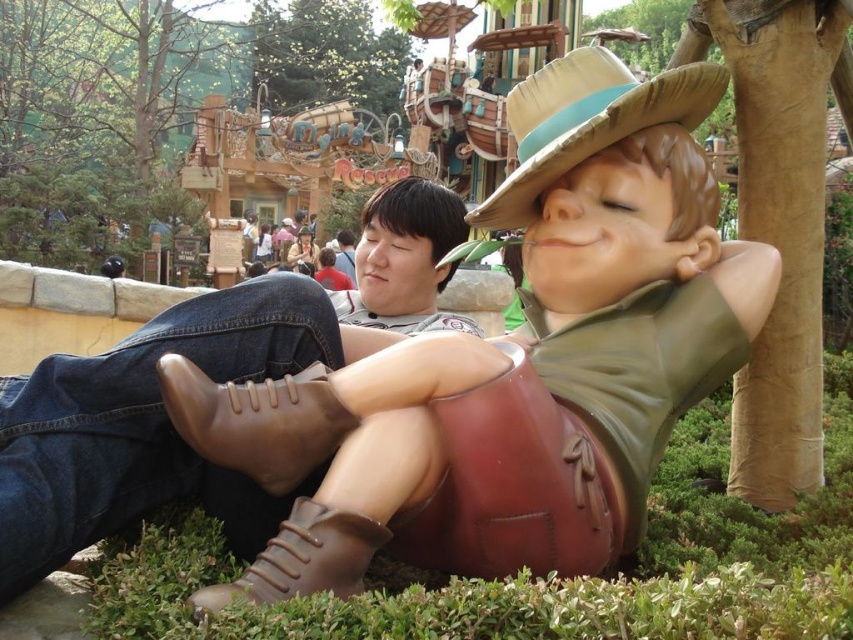
Can you confirm if brown leather boots at lower center is bigger than jeans at center?

Yes, brown leather boots at lower center is bigger than jeans at center.

Between point (0, 408) and point (339, 240), which one is positioned in front?

Point (0, 408) is in front.

I want to click on brown leather boots at lower center, so click(x=202, y=378).

Can you confirm if brown straw hat at center is smaller than jeans at center?

No, brown straw hat at center is not smaller than jeans at center.

Identify the location of brown straw hat at center. The height and width of the screenshot is (640, 853). (585, 120).

The height and width of the screenshot is (640, 853). I want to click on brown straw hat at center, so tap(585, 120).

Between brown leather boots at lower center and brown straw hat at center, which one appears on the right side from the viewer's perspective?

Positioned to the right is brown straw hat at center.

Consider the image. Who is lower down, brown leather boots at lower center or brown straw hat at center?

brown leather boots at lower center

This screenshot has height=640, width=853. What do you see at coordinates (202, 378) in the screenshot?
I see `brown leather boots at lower center` at bounding box center [202, 378].

The image size is (853, 640). I want to click on brown leather boots at lower center, so click(x=202, y=378).